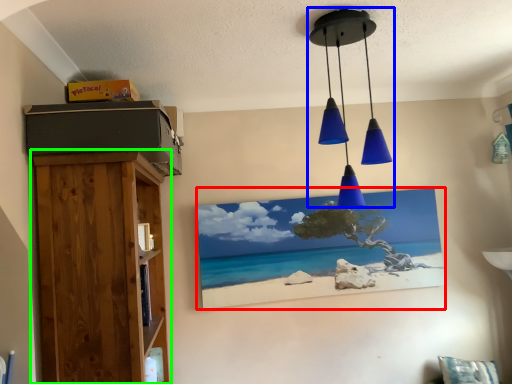
Question: Which object is positioned closest to picture frame (highlighted by a red box)? Select from lamp (highlighted by a blue box) and furniture (highlighted by a green box).

Choices:
 (A) lamp
 (B) furniture

Answer: (A)